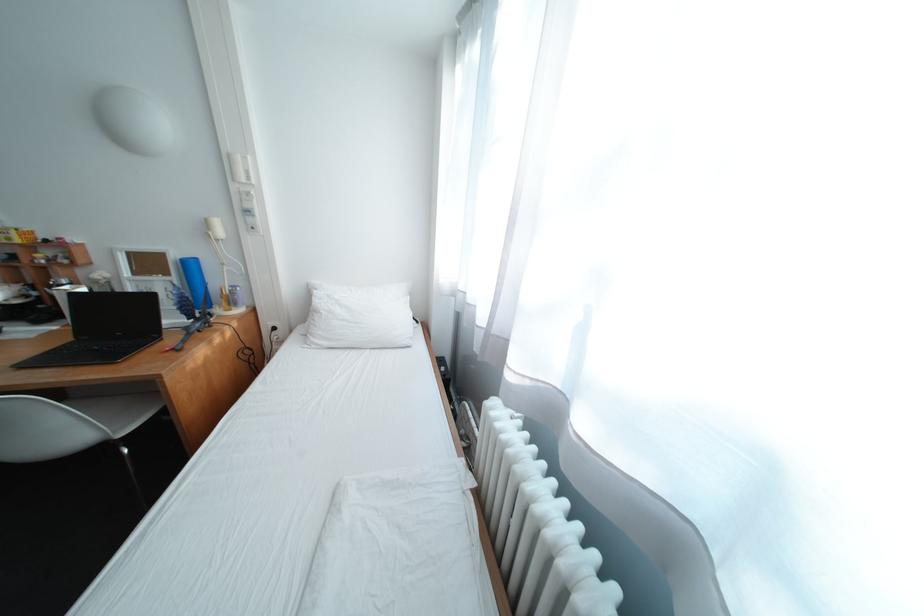
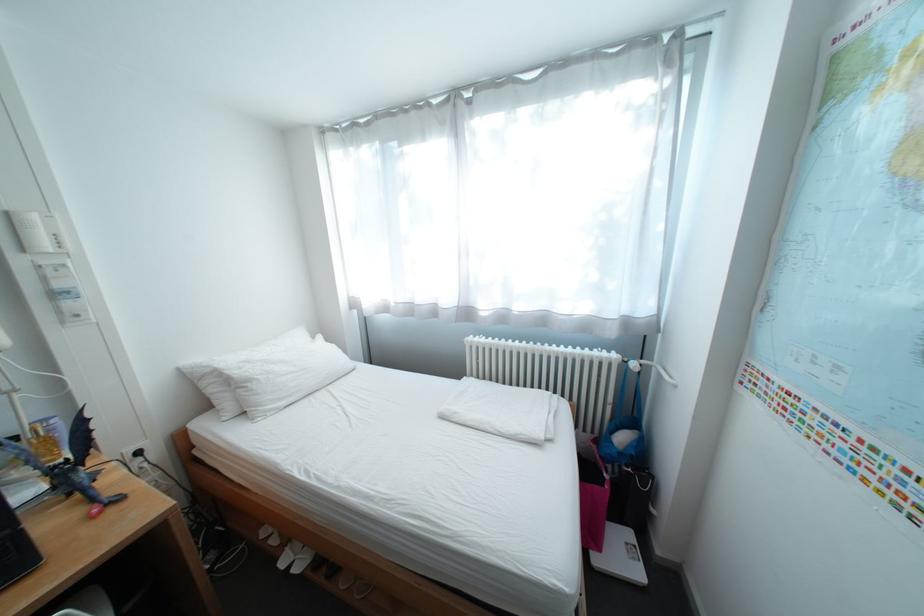
Find the pixel in the second image that matches [330,314] in the first image.

(263, 383)